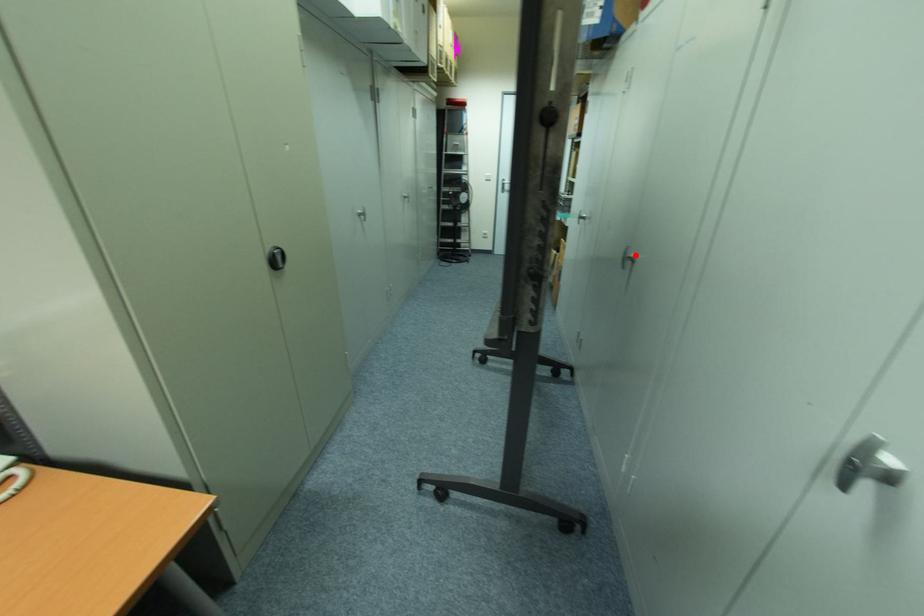
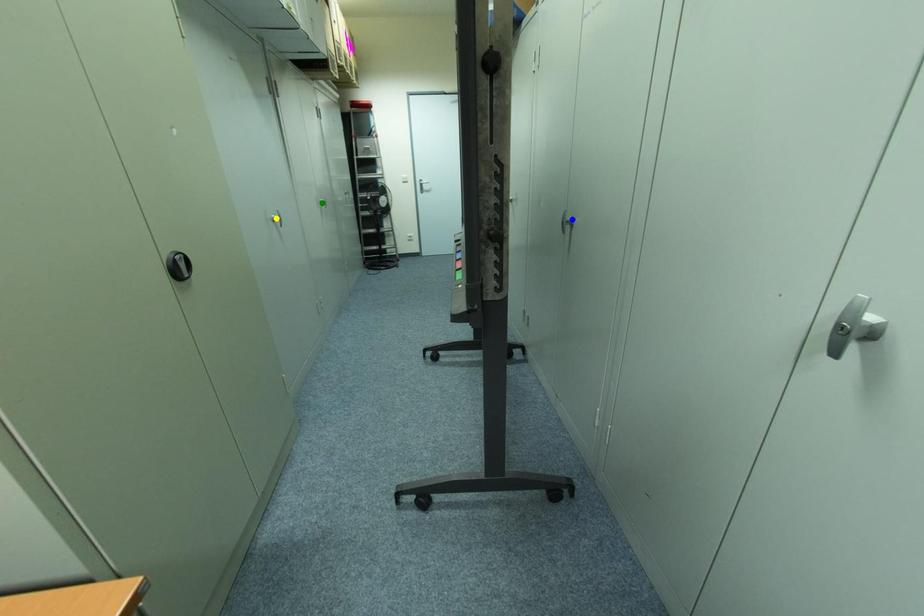
Question: I am providing you with two images of the same scene from different viewpoints. A red point is marked on the first image. You are given multiple points on the second image. Which point in image 2 represents the same 3d spot as the red point in image 1?

Choices:
 (A) yellow point
 (B) green point
 (C) blue point

Answer: (C)